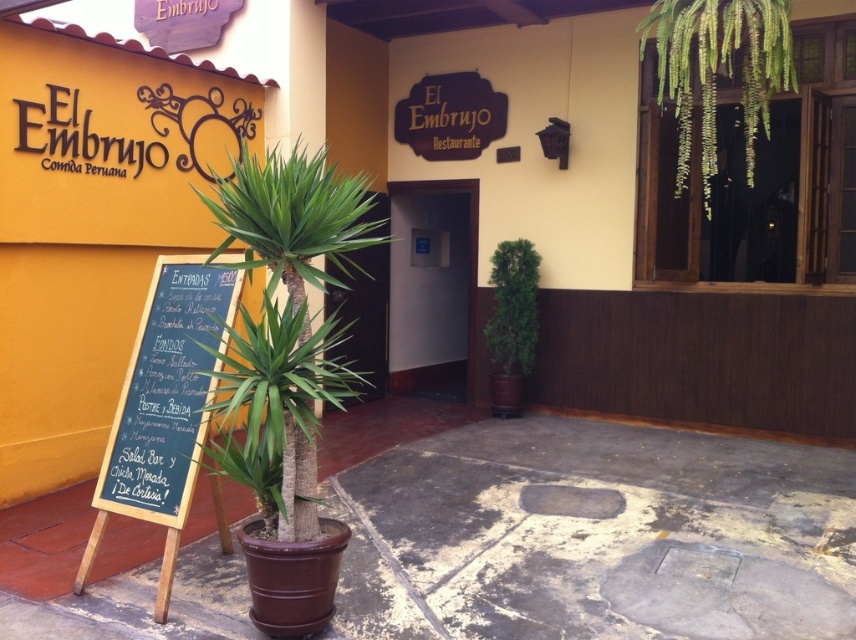
You are a customer arriving at the restaurant and want to read the menu displayed on the black chalkboard at left while standing near the green leafy palm tree at center. Can you see the entire menu without moving your head?

The green leafy palm tree at center is above the black chalkboard at left, so when standing near the green leafy palm tree at center, you can see the entire menu on the black chalkboard at left because the chalkboard is below the tree and within your line of sight.

You are standing at the entrance of El Embrujo restaurant and want to place a new menu board. The menu board must be placed to the right of the green leafy palm tree at center. Where should you position it?

The menu board should be placed to the right of the green leafy palm tree at center, which is located at point (290,305). Since the question specifies placing it to the right, the exact coordinates would depend on the desired distance, but the general direction is to the right along the x or y axis depending on the layout.